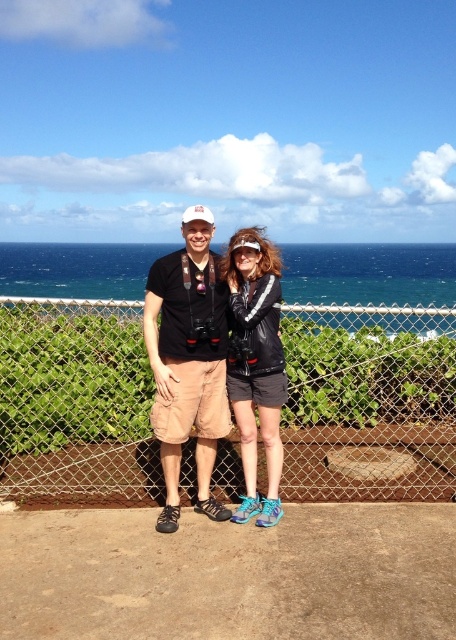
Question: Which object is the farthest from the metal mesh fence at center?

Choices:
 (A) black matte shorts at center
 (B) matte black jacket at center

Answer: (A)

Question: Which object is the farthest from the matte black jacket at center?

Choices:
 (A) black matte shorts at center
 (B) metal mesh fence at center

Answer: (B)

Question: Can you confirm if metal mesh fence at center is bigger than black matte shorts at center?

Choices:
 (A) no
 (B) yes

Answer: (A)

Question: Does metal mesh fence at center have a smaller size compared to matte black jacket at center?

Choices:
 (A) yes
 (B) no

Answer: (A)

Question: Does metal mesh fence at center appear over black matte shorts at center?

Choices:
 (A) no
 (B) yes

Answer: (A)

Question: Considering the real-world distances, which object is closest to the metal mesh fence at center?

Choices:
 (A) matte black jacket at center
 (B) black matte shorts at center

Answer: (A)